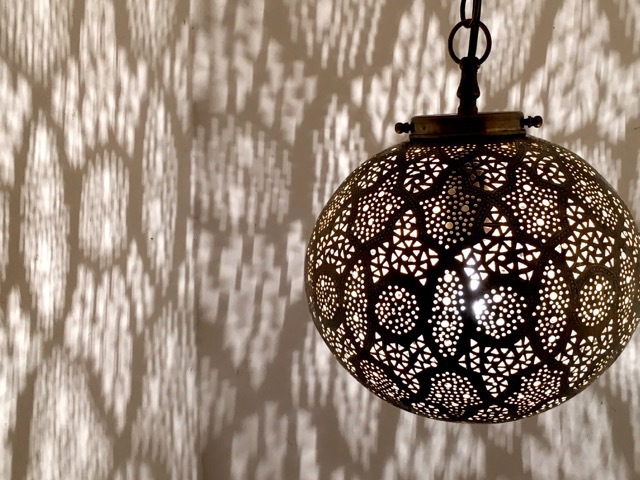
Where is `decorative shadow effect`? Image resolution: width=640 pixels, height=480 pixels. decorative shadow effect is located at coordinates (303, 177), (131, 205), (70, 172), (364, 67).